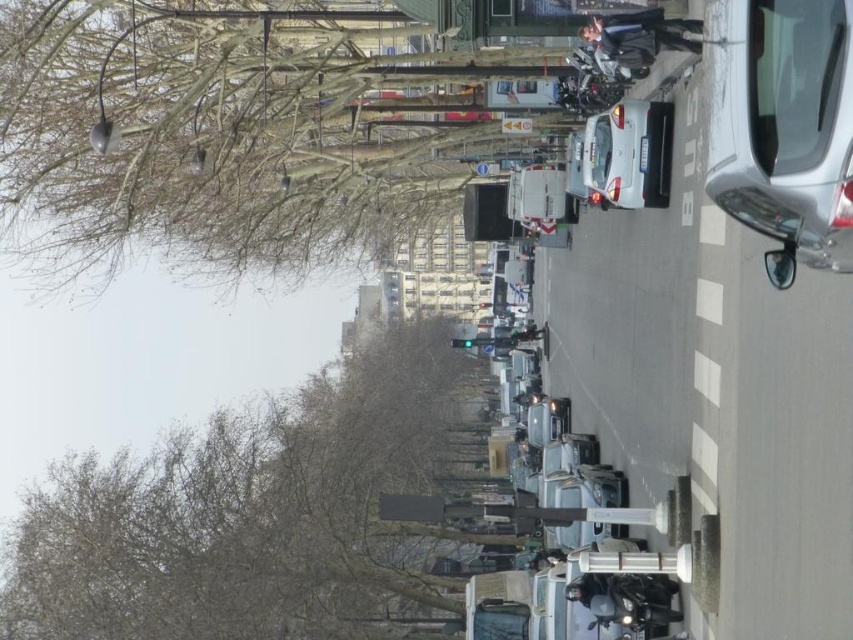
Is point (155, 173) farther from viewer compared to point (637, 173)?

Yes, point (155, 173) is behind point (637, 173).

In the scene shown: Is brown leafless tree at upper left above white glossy car at center?

Yes, brown leafless tree at upper left is above white glossy car at center.

Find the location of `brown leafless tree at upper left`. brown leafless tree at upper left is located at coordinates (216, 134).

Which is in front, point (148, 556) or point (769, 68)?

Point (769, 68) is more forward.

Identify the location of bare branches at left. (251, 513).

Between brown leafless tree at upper left and bare branches at left, which one is positioned lower?

bare branches at left

Does brown leafless tree at upper left appear under bare branches at left?

No.

Who is more forward, [163,140] or [184,529]?

Point [163,140] is more forward.

At what (x,y) coordinates should I click in order to perform the action: click on brown leafless tree at upper left. Please return your answer as a coordinate pair (x, y). The height and width of the screenshot is (640, 853). Looking at the image, I should click on (216, 134).